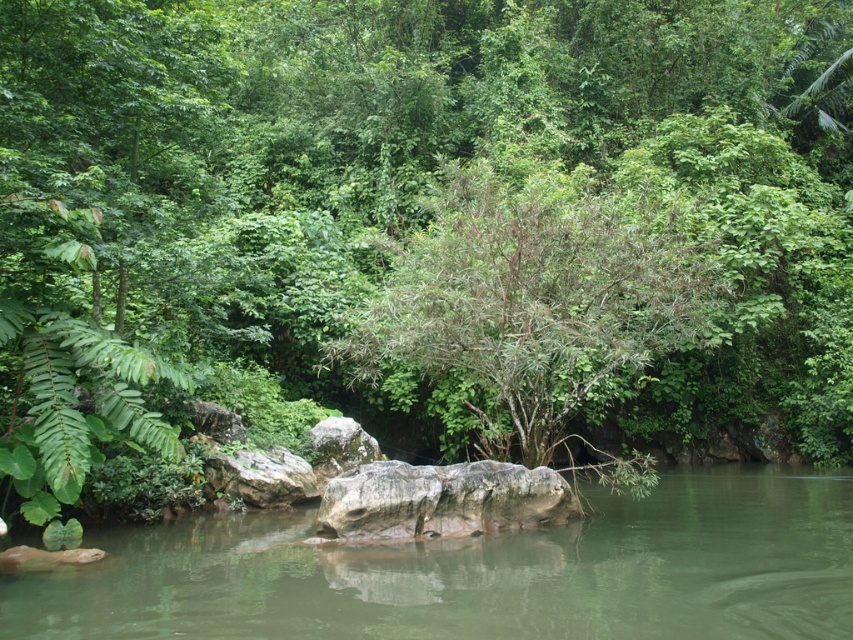
Who is taller, green smooth water at center or gray rough boulder at center?

gray rough boulder at center is taller.

Is green smooth water at center to the left of gray rough boulder at center from the viewer's perspective?

No, green smooth water at center is not to the left of gray rough boulder at center.

Does point (796, 580) come farther from viewer compared to point (453, 493)?

That is False.

Identify the location of green smooth water at center. This screenshot has width=853, height=640. (480, 572).

Locate an element on the screen. This screenshot has width=853, height=640. brown/dry wood tree at center is located at coordinates (534, 300).

Between brown/dry wood tree at center and gray rough boulder at center, which one appears on the left side from the viewer's perspective?

Positioned to the left is gray rough boulder at center.

Is point (637, 344) positioned after point (439, 477)?

Yes, it is.

Locate an element on the screen. brown/dry wood tree at center is located at coordinates (534, 300).

Does green smooth water at center have a greater width compared to brown/dry wood tree at center?

Indeed, green smooth water at center has a greater width compared to brown/dry wood tree at center.

Between point (466, 611) and point (560, 387), which one is positioned in front?

Point (466, 611) is more forward.

Who is more distant from viewer, (512, 564) or (660, 214)?

The point (660, 214) is behind.

This screenshot has width=853, height=640. Find the location of `green smooth water at center`. green smooth water at center is located at coordinates (480, 572).